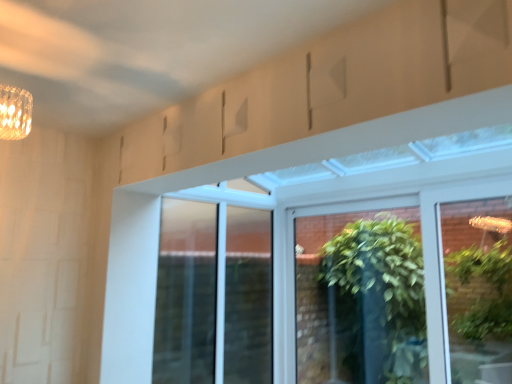
Find the location of `green leafy plant at center`. green leafy plant at center is located at coordinates point(406,288).

Image resolution: width=512 pixels, height=384 pixels. What do you see at coordinates (406, 288) in the screenshot?
I see `green leafy plant at center` at bounding box center [406, 288].

Where is `green leafy plant at center`? The image size is (512, 384). green leafy plant at center is located at coordinates (406, 288).